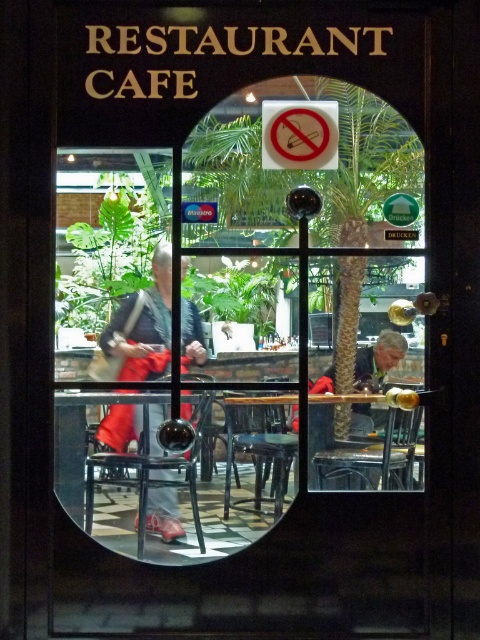
Question: Which of the following is the closest to the observer?

Choices:
 (A) (344, 369)
 (B) (226, 472)

Answer: (B)

Question: Which of these objects is positioned closest to the white paper sign at center?

Choices:
 (A) green leafy palm tree at center
 (B) black plastic stool at center
 (C) matte black jacket at center

Answer: (A)

Question: Is matte black jacket at center to the left of white paper sign at center from the viewer's perspective?

Choices:
 (A) no
 (B) yes

Answer: (B)

Question: In this image, where is white paper sign at center located relative to gray fabric jacket at lower center?

Choices:
 (A) right
 (B) left

Answer: (B)

Question: Which object is farther from the camera taking this photo?

Choices:
 (A) green leafy palm tree at center
 (B) gray fabric jacket at lower center
 (C) black plastic stool at center
 (D) matte black jacket at center

Answer: (B)

Question: Is matte black jacket at center above black plastic stool at center?

Choices:
 (A) yes
 (B) no

Answer: (A)